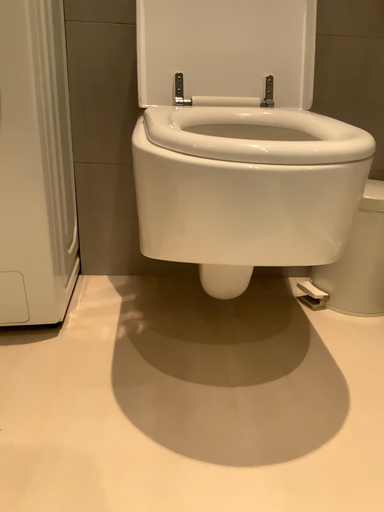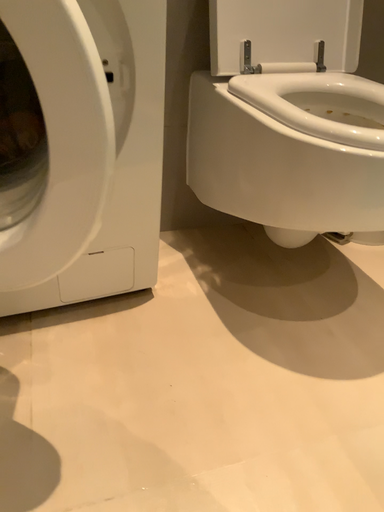
Question: Which way did the camera rotate in the video?

Choices:
 (A) rotated right
 (B) rotated left

Answer: (A)